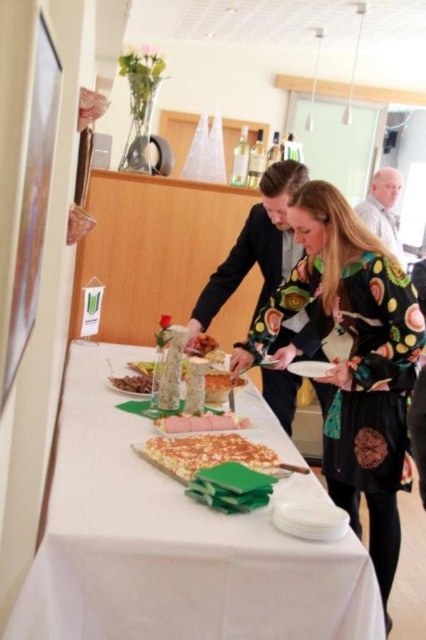
Question: Which of these objects is positioned closest to the sliced pink meat at center?

Choices:
 (A) floral-patterned dress at center
 (B) brown crumbly at center
 (C) white paper plate at center
 (D) black glossy suit at center

Answer: (B)

Question: Considering the real-world distances, which object is closest to the sliced pink meat at center?

Choices:
 (A) white shirt at upper right
 (B) brown crumbly at center

Answer: (B)

Question: Can you confirm if black glossy suit at center is positioned to the right of brown crumbly at center?

Choices:
 (A) no
 (B) yes

Answer: (B)

Question: Is glazed pastry at center wider than white shirt at upper right?

Choices:
 (A) yes
 (B) no

Answer: (B)

Question: Which point is farther to the camera?

Choices:
 (A) (213, 456)
 (B) (137, 374)
 (C) (359, 436)
 (D) (296, 164)

Answer: (B)

Question: Considering the relative positions of floral-patterned dress at center and brown crumbly at center in the image provided, where is floral-patterned dress at center located with respect to brown crumbly at center?

Choices:
 (A) below
 (B) above

Answer: (A)